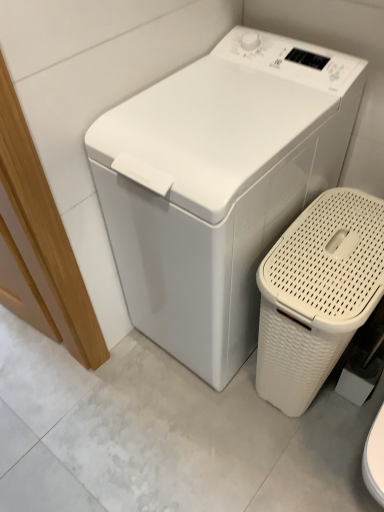
Locate an element on the screen. vacant space situated above white woven basket at lower right (from a real-world perspective) is located at coordinates (342, 241).